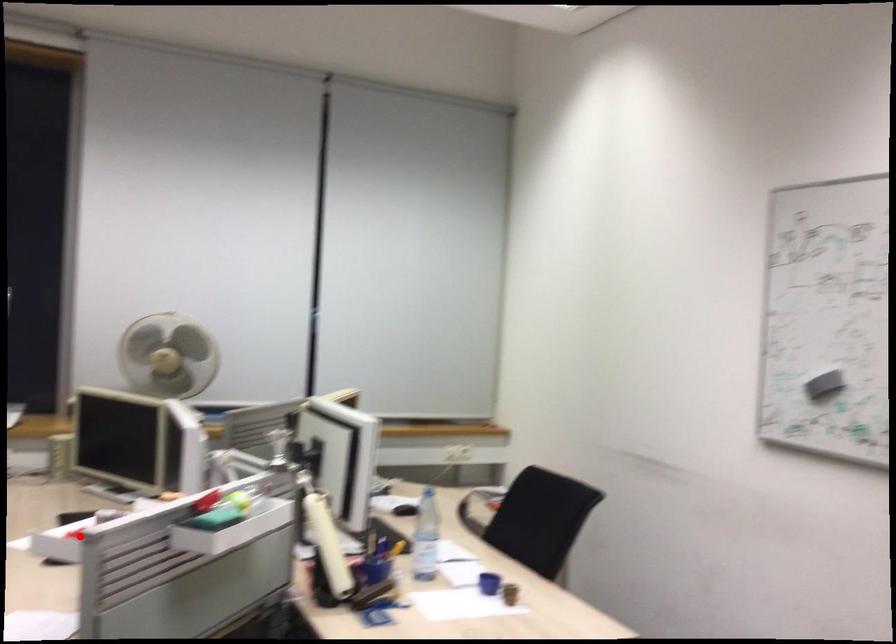
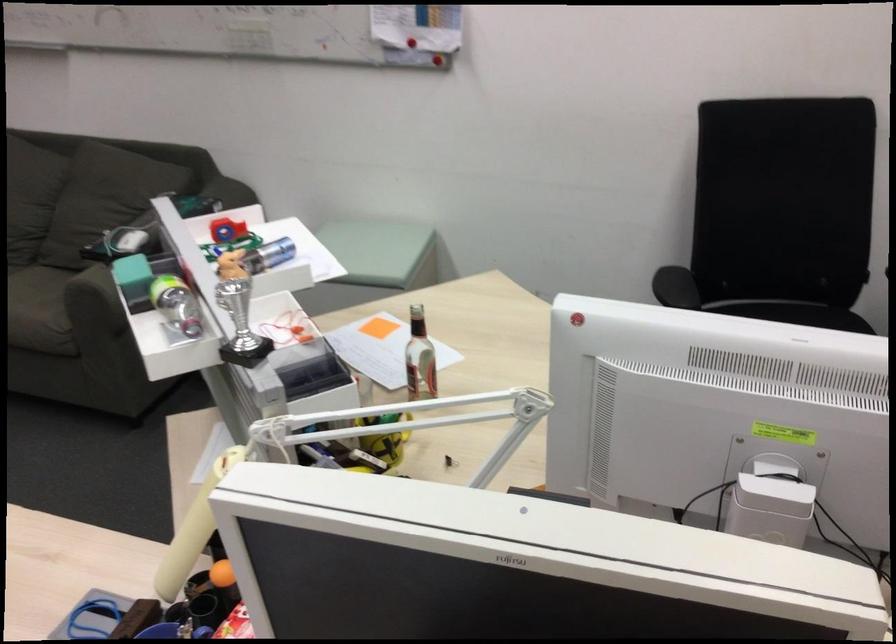
The point at the highlighted location is marked in the first image. Where is the corresponding point in the second image?

(274, 252)